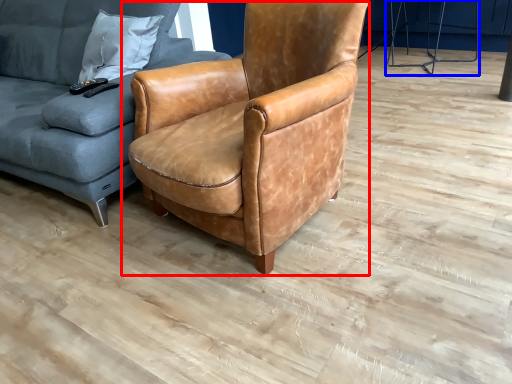
Question: Which object appears closest to the camera in this image, chair (highlighted by a red box) or half (highlighted by a blue box)?

Choices:
 (A) chair
 (B) half

Answer: (A)